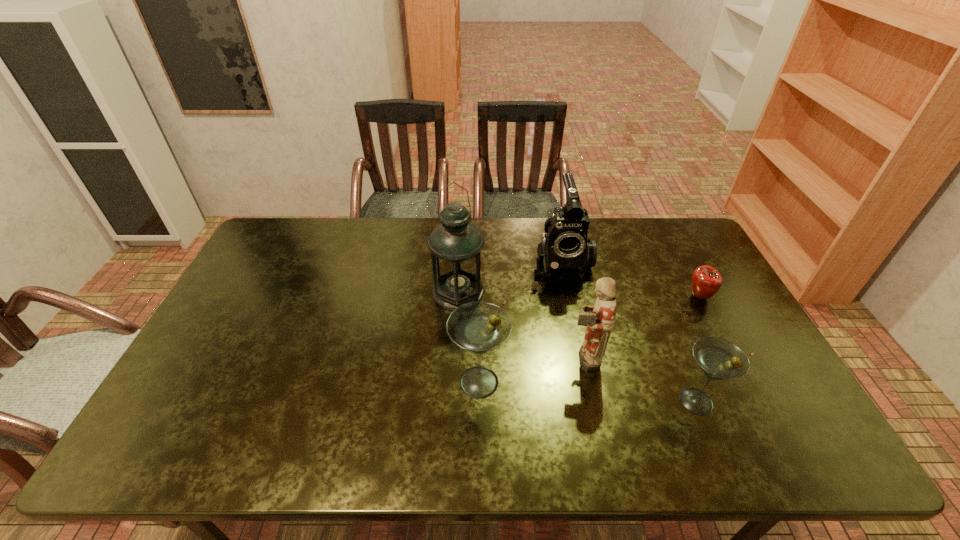
The height and width of the screenshot is (540, 960). I want to click on the taller martini, so click(x=478, y=327).

Identify the location of the shorter martini. The image size is (960, 540). (719, 359).

I want to click on the fifth tallest object, so (x=719, y=359).

Locate an element on the screen. The image size is (960, 540). camcorder is located at coordinates (566, 251).

The width and height of the screenshot is (960, 540). I want to click on the rightmost object, so click(x=706, y=281).

The height and width of the screenshot is (540, 960). I want to click on apple, so click(x=706, y=281).

What are the coordinates of `figurine` in the screenshot? It's located at (600, 318).

I want to click on oil lamp, so click(455, 245).

I want to click on free region located 0.300m on the back of the taller martini, so click(479, 284).

This screenshot has width=960, height=540. Identify the location of vacant space located 0.380m on the back of the fifth tallest object. (647, 282).